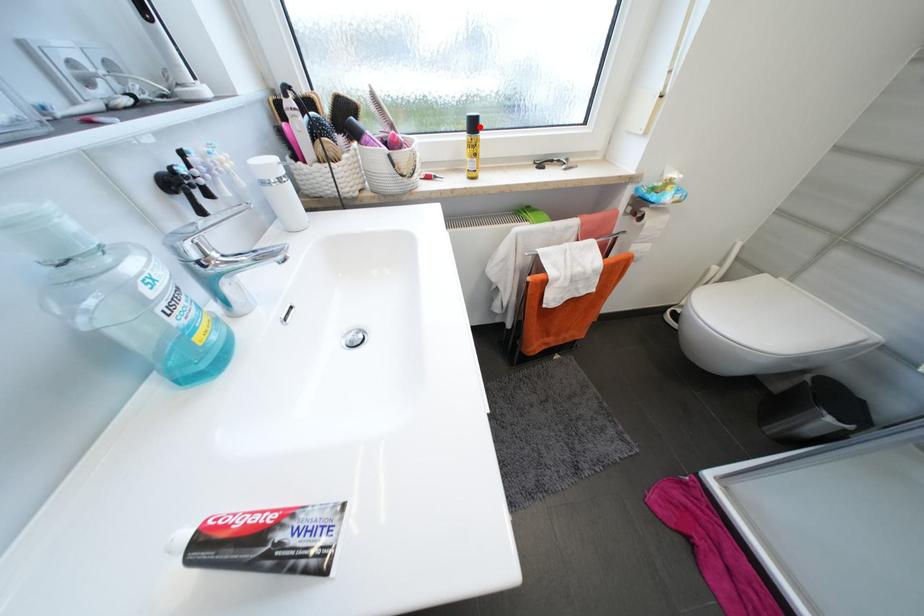
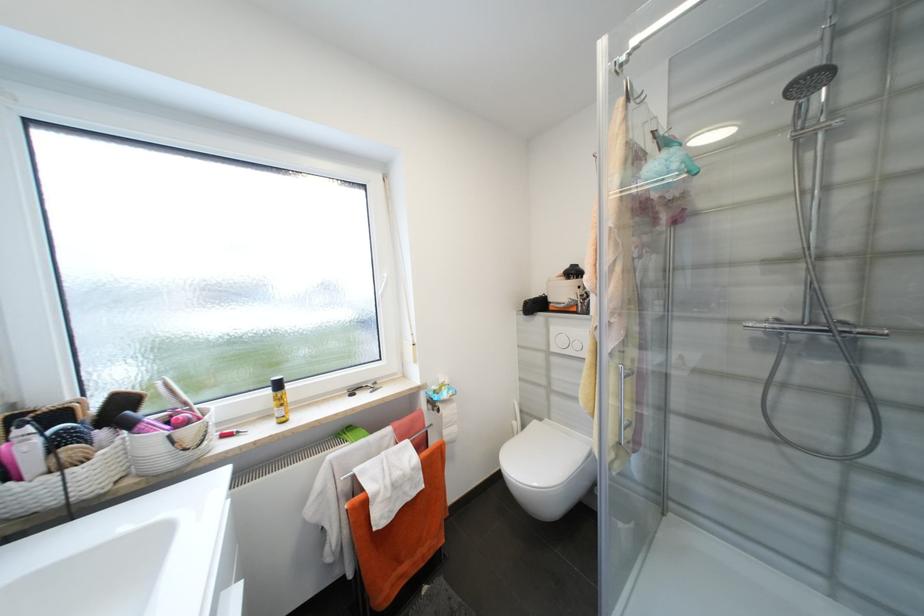
Find the pixel in the second image that matches the highlighted location in the first image.

(284, 386)